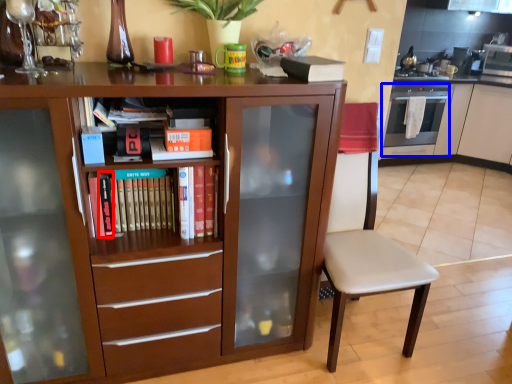
Question: Which of the following is the closest to the observer, paperback book (highlighted by a red box) or oven (highlighted by a blue box)?

Choices:
 (A) paperback book
 (B) oven

Answer: (A)